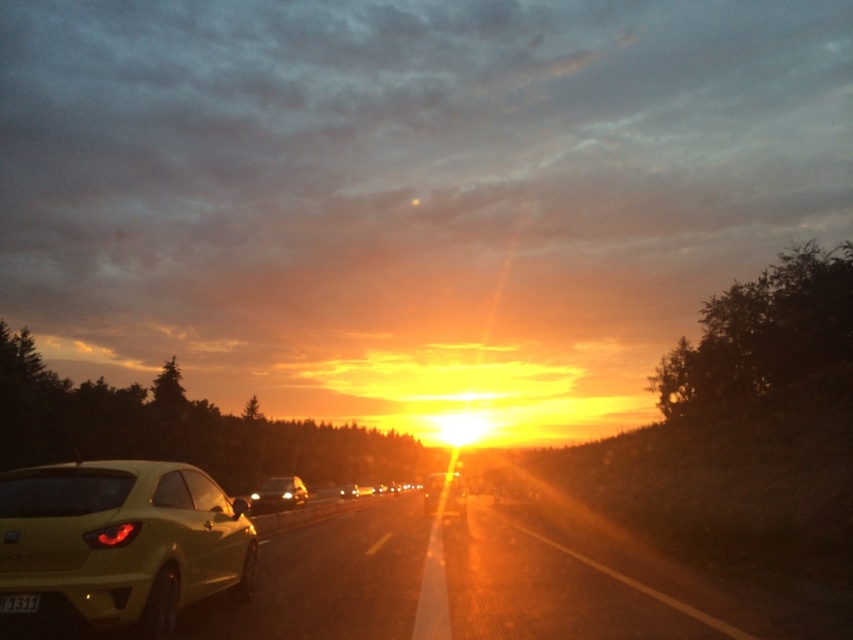
You are a photographer standing on the side of the highway. You want to capture a photo of the matte yellow car at center and the metallic gold car at center. Which car should you focus on if you want to highlight the tallest vehicle in your shot?

The matte yellow car at center has a greater height compared to metallic gold car at center, so you should focus on the matte yellow car at center to highlight the tallest vehicle in your shot.

You are driving a car and want to know if the point at coordinate [254,496] is closer to you than the point at [442,496] on the highway. Based on the scene description, can you determine which point is closer?

Point [254,496] is closer to you than point [442,496] because it is further to the viewer according to the description.